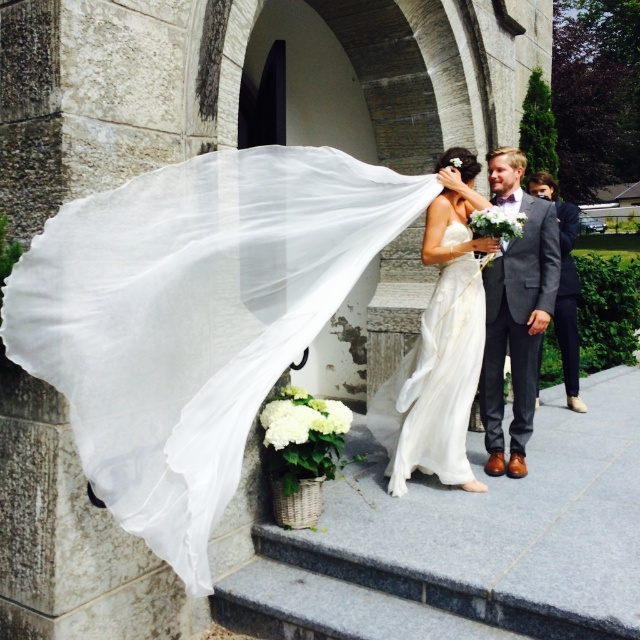
You are a photographer at the wedding and want to capture a shot of the satin white dress at center and the gray wool suit at right. Based on their positions, which one is positioned to the left side of the other?

The satin white dress at center is positioned to the left of the gray wool suit at right.

You are a photographer at a wedding and need to capture a photo where the satin white dress at center and the gray wool suit at right are both clearly visible. Based on their positions, which one is closer to the camera?

The satin white dress at center is closer to the camera because it is in front of the gray wool suit at right.